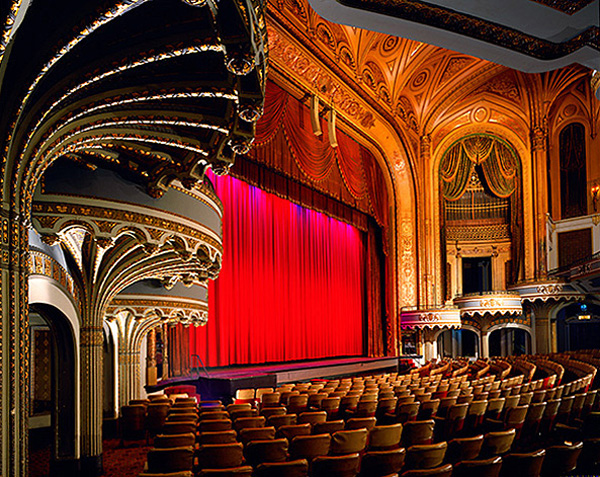
Where is `curtains`? curtains is located at coordinates (494, 181), (344, 260), (332, 205), (323, 180).